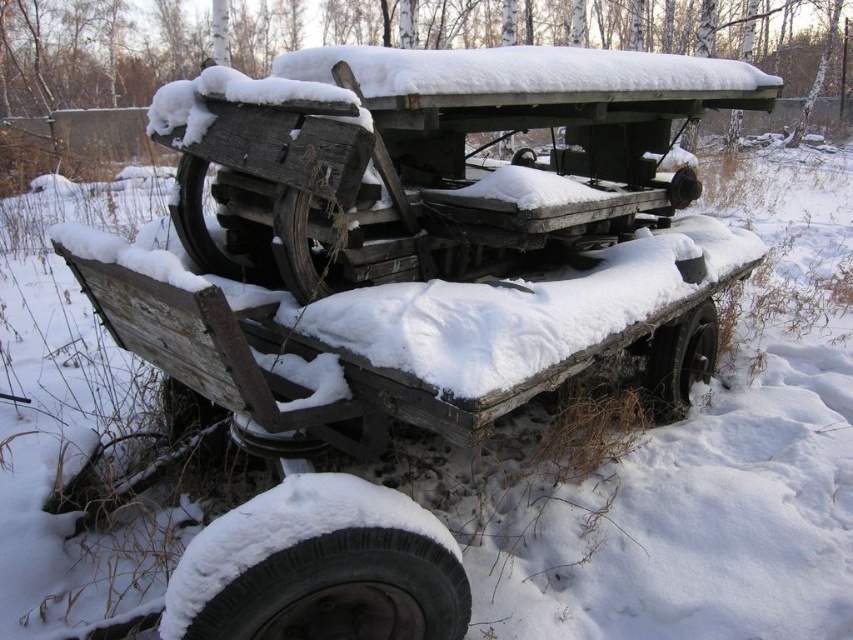
Is wooden wagon at center further to the viewer compared to dark gray rubber tire at center?

No, it is in front of dark gray rubber tire at center.

Locate an element on the screen. wooden wagon at center is located at coordinates (427, 157).

You are a GUI agent. You are given a task and a screenshot of the screen. Output one action in this format:
    pyautogui.click(x=<x>, y=<y>)
    Task: Click on the wooden wagon at center
    This screenshot has width=853, height=640.
    Given the screenshot: What is the action you would take?
    pyautogui.click(x=427, y=157)

Who is taller, wooden wagon at center or black rubber tire at lower right?

With more height is wooden wagon at center.

Does wooden wagon at center appear under black rubber tire at lower right?

No.

Which is behind, point (668, 118) or point (695, 310)?

The point (668, 118) is more distant.

Locate an element on the screen. wooden wagon at center is located at coordinates (427, 157).

Is snow-covered rubber tire at lower left positioned in front of dark gray rubber tire at center?

Yes, it is.

Can you confirm if snow-covered rubber tire at lower left is bigger than dark gray rubber tire at center?

No, snow-covered rubber tire at lower left is not bigger than dark gray rubber tire at center.

Locate an element on the screen. The height and width of the screenshot is (640, 853). snow-covered rubber tire at lower left is located at coordinates (343, 592).